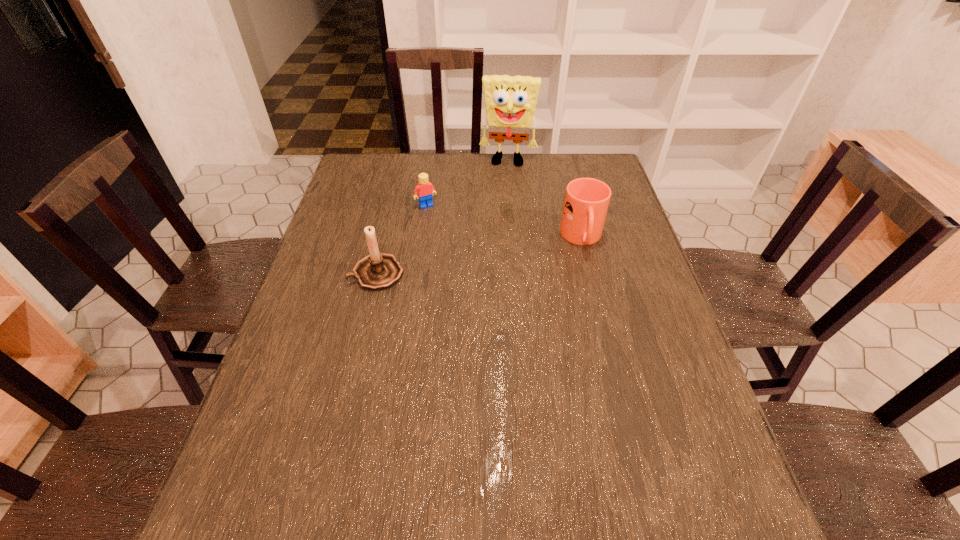
Where is `free space at the right edge of the desktop`? free space at the right edge of the desktop is located at coordinates (667, 316).

Locate an element on the screen. The height and width of the screenshot is (540, 960). vacant space at the far left corner of the desktop is located at coordinates (365, 164).

Locate an element on the screen. The height and width of the screenshot is (540, 960). free location at the far right corner of the desktop is located at coordinates click(x=603, y=170).

What are the coordinates of `free region at the near right corner of the desktop` in the screenshot? It's located at (682, 448).

Locate an element on the screen. Image resolution: width=960 pixels, height=540 pixels. free space between the second farthest object and the sponge is located at coordinates (468, 184).

Identify the location of free spot between the second farthest object and the rightmost object. (504, 222).

This screenshot has width=960, height=540. I want to click on free space between the candle holder and the rightmost object, so click(479, 256).

Locate an element on the screen. The width and height of the screenshot is (960, 540). unoccupied area between the rightmost object and the candle holder is located at coordinates (479, 256).

Find the location of a particular element. The height and width of the screenshot is (540, 960). vacant space in between the candle holder and the sponge is located at coordinates (443, 218).

In order to click on vacant space that is in between the candle holder and the mug in this screenshot , I will do `click(479, 256)`.